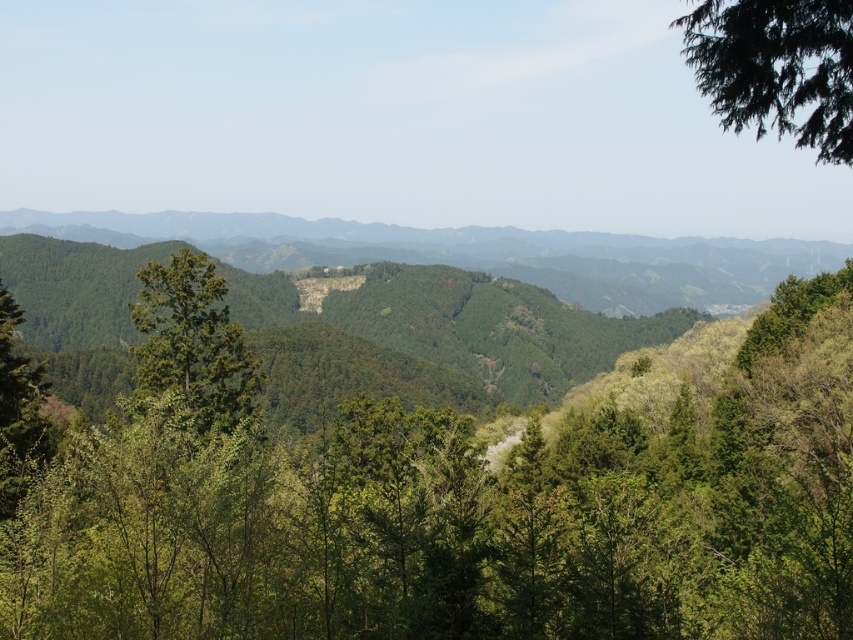
You are hiking through the mountainous landscape and see two trees at the center of your view. Which tree is positioned more to the right between the green leafy tree at center and the green matte tree at center?

The green leafy tree at center is positioned to the right of the green matte tree at center, so the green leafy tree at center is more to the right.

You are an environmental researcher studying tree distribution in this mountainous area. You observe the green leafy tree at upper right and the green matte tree at center. Which tree has a wider canopy based on their spatial characteristics?

The green leafy tree at upper right has a wider canopy than the green matte tree at center, as its width is larger according to the spatial description.